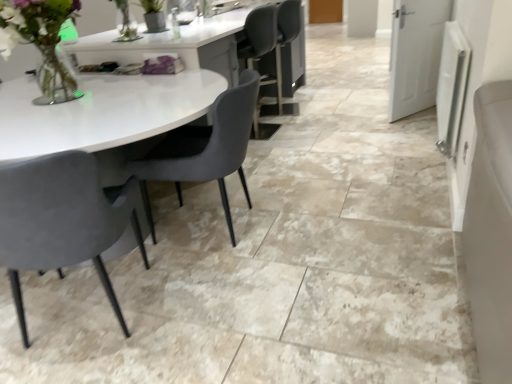
This screenshot has height=384, width=512. Find the location of `free space between matte gray chair at left, which is counted as the 1th chair, starting from the left, and velvet grey chair at center, which is the 1th chair from right to left`. free space between matte gray chair at left, which is counted as the 1th chair, starting from the left, and velvet grey chair at center, which is the 1th chair from right to left is located at coordinates (174, 278).